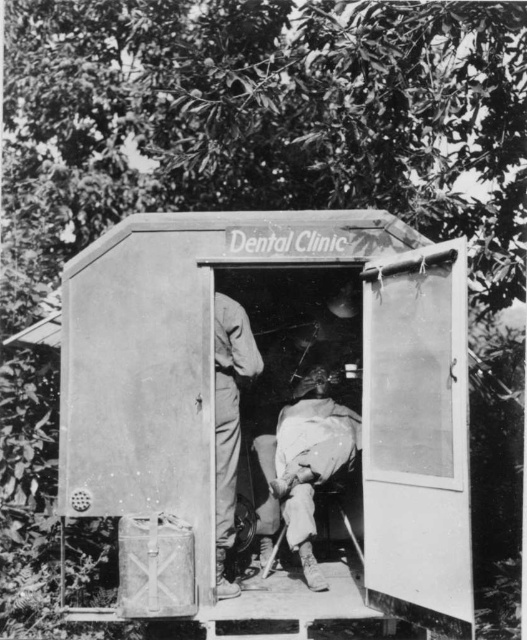
You are a dental assistant who needs to move a tray of instruments from the metallic gray hut at center to the matte khaki pants at center. Can you do this without bending down?

The metallic gray hut at center and matte khaki pants at center are 20.21 inches apart. Since the distance is relatively short, you can likely reach the tray without bending down, provided the tray is within arm reach and the path is clear.

You are a patient visiting the dental clinic shown in the image. You need to retrieve your personal items stored in the metal container on the left side of the entrance. However, you must remain seated on the dental chair covered by the white fabric cloth at center. Can you reach the metal container from your seated position?

The white fabric cloth at center is 5.18 meters away from the camera, meaning the distance between the dental chair and the metal container is too far to reach. You cannot retrieve your items while remaining seated.